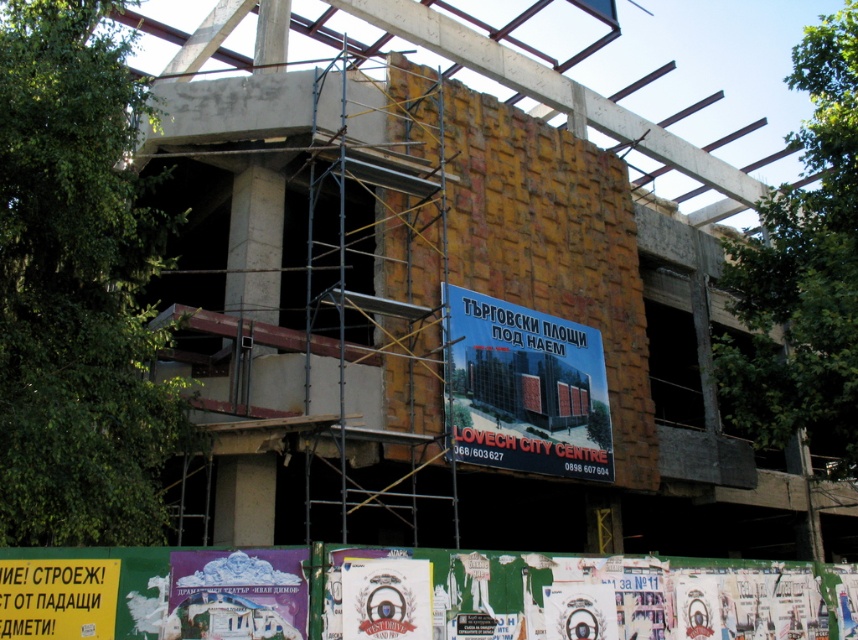
You are a delivery person who needs to place a large package on the purple paper at center. However, the matte blue signboard at center is blocking the path. Can you fit the package between them?

The matte blue signboard at center is larger in size than the purple paper at center, so there might not be enough space to fit the package between them. You should consider an alternative route or reposition the purple paper at center to ensure safe delivery.

You are a construction worker who needs to install a safety net between the yellowish wood scaffolding at center and the matte blue signboard at center. Which object should the safety net be attached to first based on their sizes?

The yellowish wood scaffolding at center is bigger than the matte blue signboard at center, so the safety net should be attached to the yellowish wood scaffolding at center first.

You are an inspector checking the construction site. You notice the yellowish wood scaffolding at center and the matte blue signboard at center. Which object has a smaller width between them?

The yellowish wood scaffolding at center is thinner than the matte blue signboard at center, so the yellowish wood scaffolding at center has a smaller width.